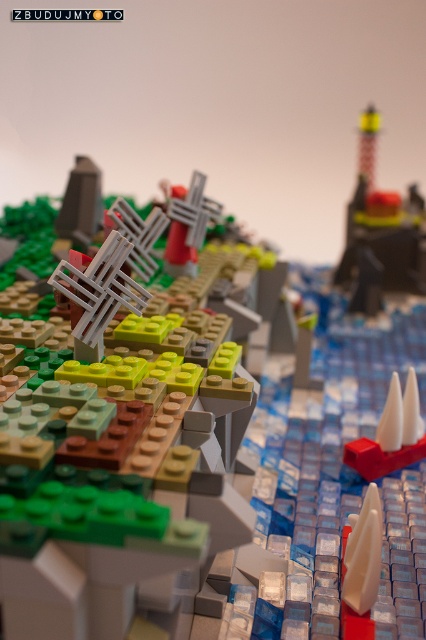
Question: Which point is farther from the camera taking this photo?

Choices:
 (A) pyautogui.click(x=356, y=193)
 (B) pyautogui.click(x=379, y=433)

Answer: (A)

Question: Is smooth black lighthouse at upper right further to the viewer compared to white plastic sailboat at center-right?

Choices:
 (A) yes
 (B) no

Answer: (A)

Question: Is smooth black lighthouse at upper right further to the viewer compared to white plastic sailboat at center-right?

Choices:
 (A) no
 (B) yes

Answer: (B)

Question: Which object is farther from the camera taking this photo?

Choices:
 (A) white plastic sailboat at center-right
 (B) smooth black lighthouse at upper right

Answer: (B)

Question: Can you confirm if smooth black lighthouse at upper right is smaller than white plastic sailboat at center-right?

Choices:
 (A) yes
 (B) no

Answer: (B)